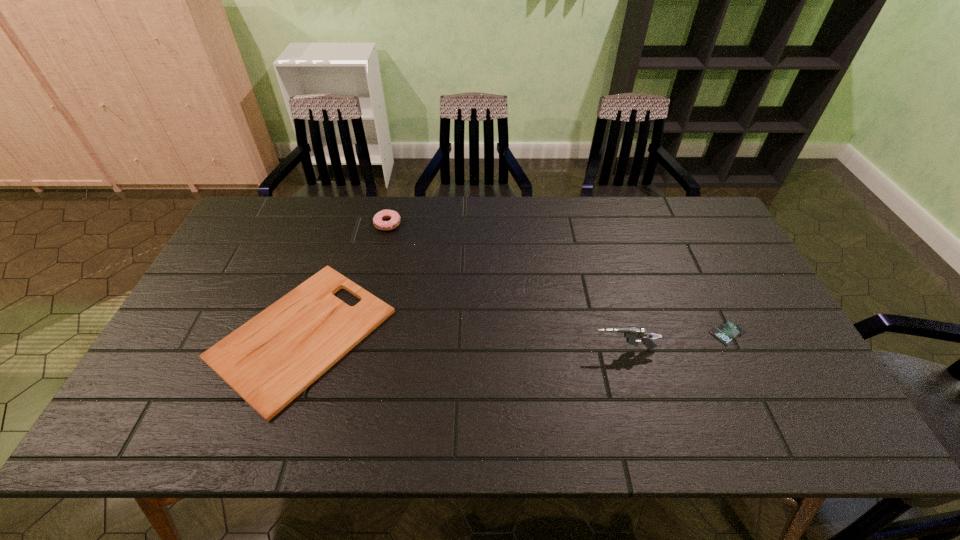
Locate an element on the screen. The height and width of the screenshot is (540, 960). the third object from left to right is located at coordinates (631, 334).

Image resolution: width=960 pixels, height=540 pixels. I want to click on gun, so click(631, 334).

Where is `the farthest object`? Image resolution: width=960 pixels, height=540 pixels. the farthest object is located at coordinates (378, 222).

Where is `the third shortest object`? the third shortest object is located at coordinates (378, 222).

This screenshot has width=960, height=540. What are the coordinates of `chopping board` in the screenshot? It's located at (271, 359).

In order to click on the rightmost object in this screenshot , I will do `click(727, 331)`.

Locate an element on the screen. The image size is (960, 540). identity card is located at coordinates (727, 331).

Locate an element on the screen. The width and height of the screenshot is (960, 540). free space located 0.290m at the barrel of the tallest object is located at coordinates (478, 349).

Locate an element on the screen. vacant space located 0.400m at the barrel of the tallest object is located at coordinates (436, 349).

Where is `vacant space located at the barrel of the tallest object`? The width and height of the screenshot is (960, 540). vacant space located at the barrel of the tallest object is located at coordinates (447, 349).